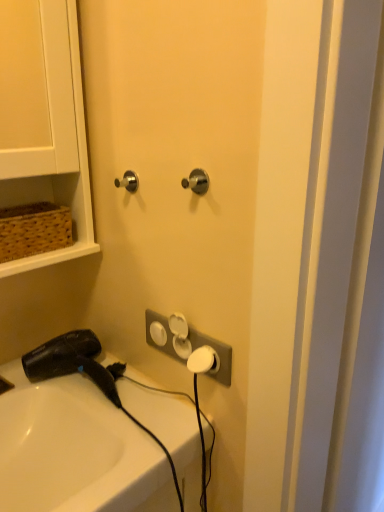
Question: From a real-world perspective, does satin nickel door handle at upper left, arranged as the 1th door handle when viewed from the back, sit lower than brown woven basket at upper left?

Choices:
 (A) no
 (B) yes

Answer: (A)

Question: From a real-world perspective, is satin nickel door handle at upper left, arranged as the 1th door handle when viewed from the back, on brown woven basket at upper left?

Choices:
 (A) no
 (B) yes

Answer: (B)

Question: Is the surface of satin nickel door handle at upper left, arranged as the 1th door handle when viewed from the back, in direct contact with brown woven basket at upper left?

Choices:
 (A) yes
 (B) no

Answer: (B)

Question: Considering the relative sizes of satin nickel door handle at upper left, which is the 2th door handle in right-to-left order, and brown woven basket at upper left in the image provided, is satin nickel door handle at upper left, which is the 2th door handle in right-to-left order, wider than brown woven basket at upper left?

Choices:
 (A) no
 (B) yes

Answer: (A)

Question: Considering the relative sizes of satin nickel door handle at upper left, the second door handle in the front-to-back sequence, and brown woven basket at upper left in the image provided, is satin nickel door handle at upper left, the second door handle in the front-to-back sequence, taller than brown woven basket at upper left?

Choices:
 (A) yes
 (B) no

Answer: (B)

Question: Visually, is satin nickel knob at center, the second door handle from the left, positioned to the left or to the right of brown woven basket at upper left?

Choices:
 (A) right
 (B) left

Answer: (A)

Question: Is satin nickel knob at center, acting as the first door handle starting from the right, wider or thinner than brown woven basket at upper left?

Choices:
 (A) wide
 (B) thin

Answer: (B)

Question: From a real-world perspective, is satin nickel knob at center, arranged as the second door handle when viewed from the back, positioned above or below brown woven basket at upper left?

Choices:
 (A) above
 (B) below

Answer: (A)

Question: Is point (187, 179) positioned closer to the camera than point (82, 251)?

Choices:
 (A) closer
 (B) farther

Answer: (A)

Question: In the image, is white glossy sink at lower left positioned in front of or behind brown woven basket at upper left?

Choices:
 (A) front
 (B) behind

Answer: (A)

Question: In terms of size, does white glossy sink at lower left appear bigger or smaller than brown woven basket at upper left?

Choices:
 (A) small
 (B) big

Answer: (B)

Question: Considering the positions of white glossy sink at lower left and brown woven basket at upper left in the image, is white glossy sink at lower left taller or shorter than brown woven basket at upper left?

Choices:
 (A) tall
 (B) short

Answer: (A)

Question: Is white glossy sink at lower left situated inside brown woven basket at upper left or outside?

Choices:
 (A) inside
 (B) outside

Answer: (B)

Question: Considering the positions of brown woven basket at upper left and white glossy sink at lower left in the image, is brown woven basket at upper left bigger or smaller than white glossy sink at lower left?

Choices:
 (A) small
 (B) big

Answer: (A)

Question: Is brown woven basket at upper left in front of or behind white glossy sink at lower left in the image?

Choices:
 (A) behind
 (B) front

Answer: (A)